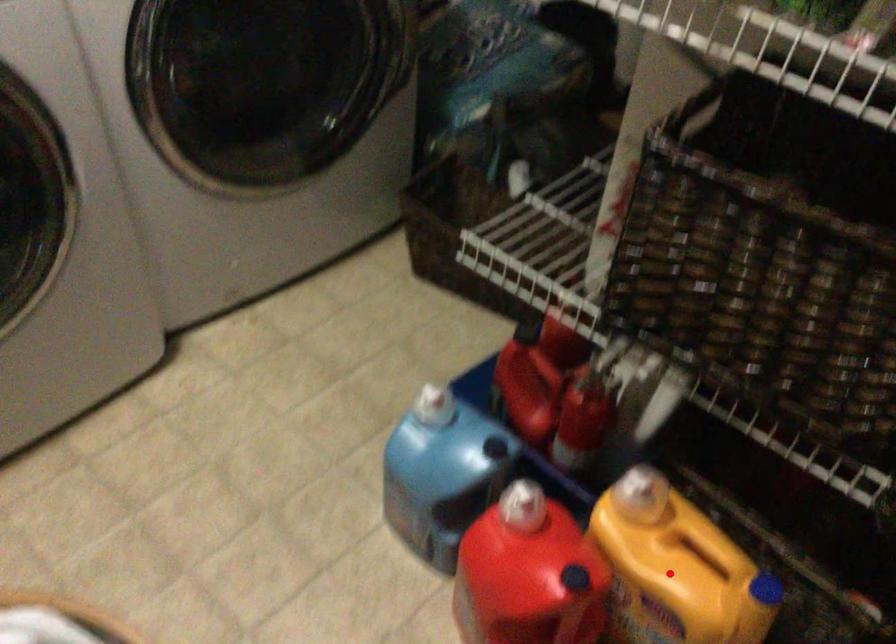
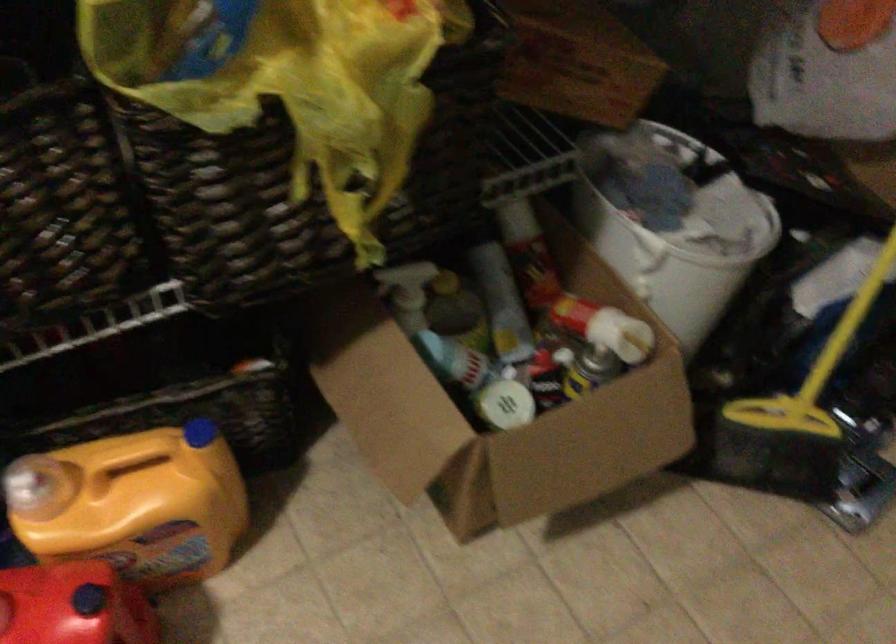
The point at the highlighted location is marked in the first image. Where is the corresponding point in the second image?

(133, 504)